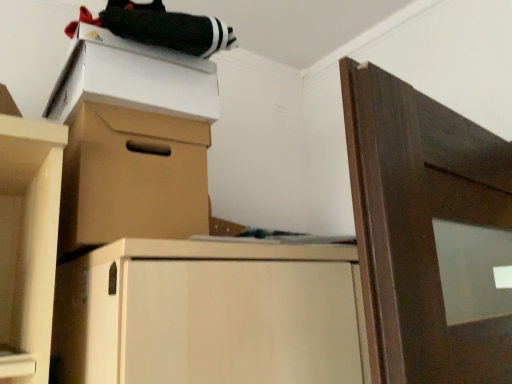
Find the location of a particular element. brown cardboard box at upper center is located at coordinates click(132, 177).

The image size is (512, 384). What do you see at coordinates (132, 177) in the screenshot?
I see `brown cardboard box at upper center` at bounding box center [132, 177].

What is the approximate height of white cardboard box at upper left?

white cardboard box at upper left is 5.40 inches in height.

Image resolution: width=512 pixels, height=384 pixels. I want to click on white cardboard box at upper left, so click(133, 78).

In order to face white cardboard box at upper left, should I rotate leftwards or rightwards?

Rotate your view left by about 17.181°.

What do you see at coordinates (133, 78) in the screenshot? The image size is (512, 384). I see `white cardboard box at upper left` at bounding box center [133, 78].

Locate an element on the screen. The height and width of the screenshot is (384, 512). brown cardboard box at upper center is located at coordinates (132, 177).

Based on the photo, which is more to the right, brown cardboard box at upper center or white cardboard box at upper left?

From the viewer's perspective, brown cardboard box at upper center appears more on the right side.

Does brown cardboard box at upper center lie in front of white cardboard box at upper left?

Yes, the depth of brown cardboard box at upper center is less than that of white cardboard box at upper left.

Between point (142, 160) and point (150, 62), which one is positioned behind?

Point (150, 62)

From the image's perspective, does brown cardboard box at upper center appear higher than white cardboard box at upper left?

Incorrect, from the image's perspective, brown cardboard box at upper center is lower than white cardboard box at upper left.

From a real-world perspective, is brown cardboard box at upper center on top of white cardboard box at upper left?

No, from a real-world perspective, brown cardboard box at upper center is not on top of white cardboard box at upper left.

Which of these two, brown cardboard box at upper center or white cardboard box at upper left, is thinner?

With smaller width is brown cardboard box at upper center.

Consider the image. Can you confirm if brown cardboard box at upper center is taller than white cardboard box at upper left?

Indeed, brown cardboard box at upper center has a greater height compared to white cardboard box at upper left.

Is brown cardboard box at upper center smaller than white cardboard box at upper left?

No.

In the scene shown: Would you say brown cardboard box at upper center is inside or outside white cardboard box at upper left?

The correct answer is: outside.

Is brown cardboard box at upper center directly adjacent to white cardboard box at upper left?

brown cardboard box at upper center and white cardboard box at upper left are clearly separated.

Is brown cardboard box at upper center facing away from white cardboard box at upper left?

No, white cardboard box at upper left is not at the back of brown cardboard box at upper center.

Where is `cabinetry on the right of white cardboard box at upper left`? The image size is (512, 384). cabinetry on the right of white cardboard box at upper left is located at coordinates (132, 177).

From the picture: Is white cardboard box at upper left to the left or to the right of brown cardboard box at upper center in the image?

white cardboard box at upper left is to the left of brown cardboard box at upper center.

Is the depth of white cardboard box at upper left less than that of brown cardboard box at upper center?

That is False.

Does point (210, 66) come closer to viewer compared to point (115, 205)?

No, (210, 66) is behind (115, 205).

From the image's perspective, relative to brown cardboard box at upper center, is white cardboard box at upper left above or below?

white cardboard box at upper left is situated higher than brown cardboard box at upper center in the image.

From a real-world perspective, is white cardboard box at upper left under brown cardboard box at upper center?

Incorrect, from a real-world perspective, white cardboard box at upper left is higher than brown cardboard box at upper center.

Considering the sizes of objects white cardboard box at upper left and brown cardboard box at upper center in the image provided, who is wider, white cardboard box at upper left or brown cardboard box at upper center?

With larger width is white cardboard box at upper left.

Considering the sizes of objects white cardboard box at upper left and brown cardboard box at upper center in the image provided, who is taller, white cardboard box at upper left or brown cardboard box at upper center?

Standing taller between the two is brown cardboard box at upper center.

Looking at the image, does white cardboard box at upper left seem bigger or smaller compared to brown cardboard box at upper center?

white cardboard box at upper left is smaller than brown cardboard box at upper center.

Is brown cardboard box at upper center inside white cardboard box at upper left?

Actually, brown cardboard box at upper center is outside white cardboard box at upper left.

Is the surface of white cardboard box at upper left in direct contact with brown cardboard box at upper center?

white cardboard box at upper left and brown cardboard box at upper center are clearly separated.

Could you tell me if white cardboard box at upper left is turned towards brown cardboard box at upper center?

No.

How different are the orientations of white cardboard box at upper left and brown cardboard box at upper center in degrees?

The facing directions of white cardboard box at upper left and brown cardboard box at upper center are 2.44 degrees apart.

At what (x,y) coordinates should I click in order to perform the action: click on cabinetry in front of the white cardboard box at upper left. Please return your answer as a coordinate pair (x, y). This screenshot has width=512, height=384. Looking at the image, I should click on (132, 177).

Where is `cabinetry below the white cardboard box at upper left (from the image's perspective)`? This screenshot has width=512, height=384. cabinetry below the white cardboard box at upper left (from the image's perspective) is located at coordinates (132, 177).

You are a GUI agent. You are given a task and a screenshot of the screen. Output one action in this format:
    pyautogui.click(x=<x>, y=<y>)
    Task: Click on the cardboard box on the left of brown cardboard box at upper center
    This screenshot has width=512, height=384.
    Given the screenshot: What is the action you would take?
    pyautogui.click(x=133, y=78)